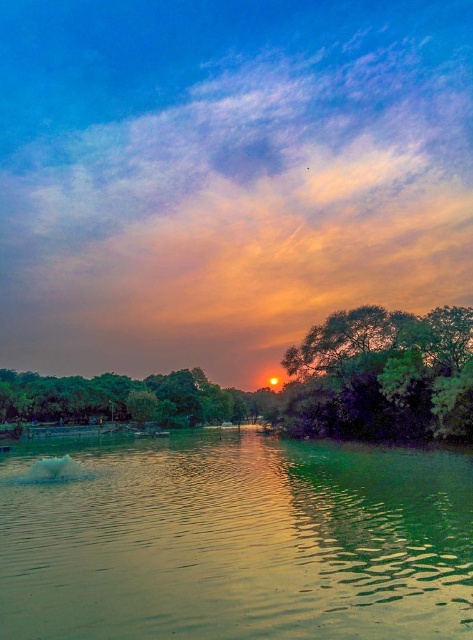
Does green smooth water at center have a larger size compared to green leafy trees at center?

No, green smooth water at center is not bigger than green leafy trees at center.

Is point (66, 580) farther from viewer compared to point (140, 381)?

That is False.

The image size is (473, 640). I want to click on green smooth water at center, so (x=238, y=541).

Based on the photo, is the position of green smooth water at center less distant than that of green leafy tree at center?

Yes, it is in front of green leafy tree at center.

Is green smooth water at center taller than green leafy tree at center?

In fact, green smooth water at center may be shorter than green leafy tree at center.

Is point (50, 557) positioned after point (388, 420)?

No, it is in front of (388, 420).

Identify the location of green smooth water at center. This screenshot has width=473, height=640. (238, 541).

Is point (298, 348) less distant than point (229, 413)?

Yes.

Does green leafy tree at center have a smaller size compared to green leafy trees at center?

Correct, green leafy tree at center occupies less space than green leafy trees at center.

Is point (470, 420) closer to viewer compared to point (105, 387)?

Yes, it is in front of point (105, 387).

You are a GUI agent. You are given a task and a screenshot of the screen. Output one action in this format:
    pyautogui.click(x=<x>, y=<y>)
    Task: Click on the green leafy tree at center
    
    Given the screenshot: What is the action you would take?
    pyautogui.click(x=384, y=376)